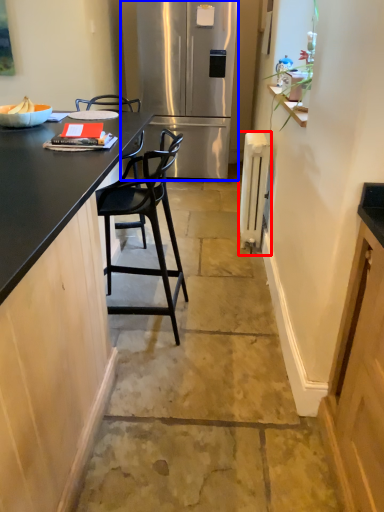
Question: Which object is closer to the camera taking this photo, appliance (highlighted by a red box) or refrigerator (highlighted by a blue box)?

Choices:
 (A) appliance
 (B) refrigerator

Answer: (A)